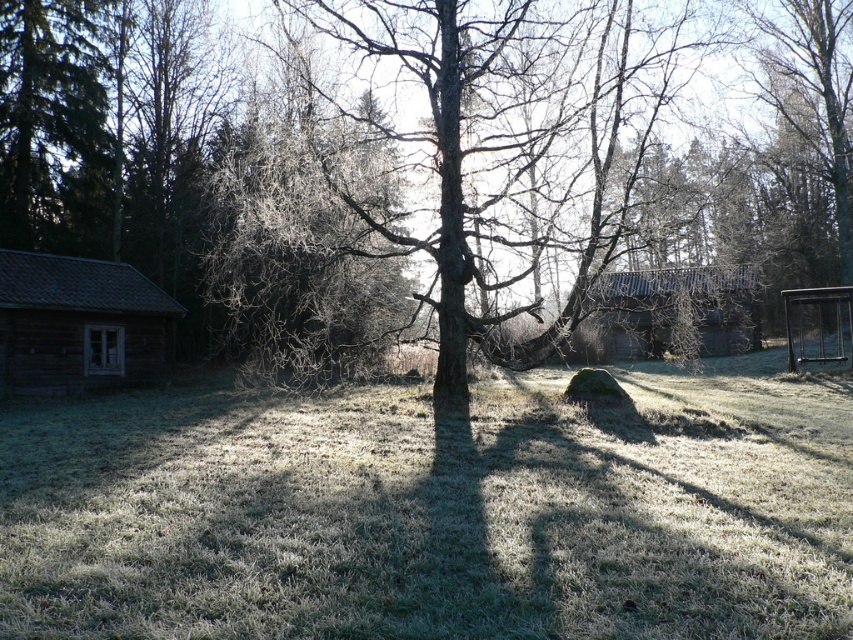
You are standing in the rural scene and want to walk from the wooden cabin at left to the brown rough tree at center. Which direction should you head?

You should head to the right to reach the brown rough tree at center from the wooden cabin at left since the brown rough tree at center is to the right of wooden cabin at left.

In the scene shown: You are standing in the middle of the grassy area and want to walk to both the wooden cabin at left and the rustic wooden cabin at center. Which cabin will you reach first?

You will reach the wooden cabin at left first because it is closer to you than the rustic wooden cabin at center, which is further away.

Consider the image. You are standing in the middle of the grassy area and want to walk to the rustic wooden cabin at center. Which direction should you walk to avoid the brown rough tree at center?

The brown rough tree at center is positioned on the left side of rustic wooden cabin at center, so to avoid it, you should walk to the right side of the cabin.